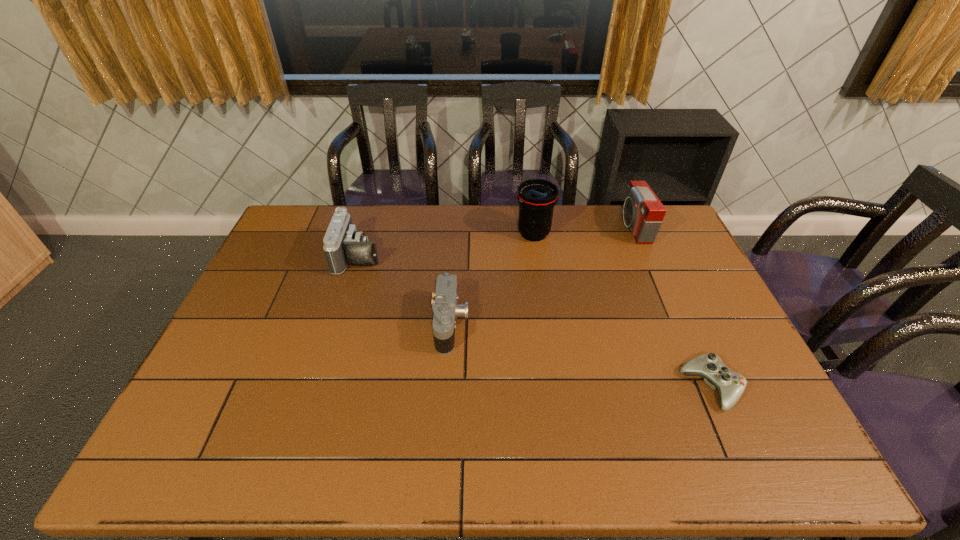
Where is `free location that satisfies the following two spatial constraints: 1. on the front-facing side of the rightmost camera; 2. on the back side of the shortest object`? free location that satisfies the following two spatial constraints: 1. on the front-facing side of the rightmost camera; 2. on the back side of the shortest object is located at coordinates (702, 387).

This screenshot has height=540, width=960. I want to click on vacant point that satisfies the following two spatial constraints: 1. on the lens of the fourth tallest object; 2. on the left side of the shortest object, so click(446, 387).

At what (x,y) coordinates should I click in order to perform the action: click on vacant area that satisfies the following two spatial constraints: 1. on the lens of the nearest camera; 2. on the back side of the control. Please return your answer as a coordinate pair (x, y). Looking at the image, I should click on (446, 387).

Where is `free spot that satisfies the following two spatial constraints: 1. on the back side of the control; 2. on the front-facing side of the rightmost camera`? This screenshot has height=540, width=960. free spot that satisfies the following two spatial constraints: 1. on the back side of the control; 2. on the front-facing side of the rightmost camera is located at coordinates (640, 227).